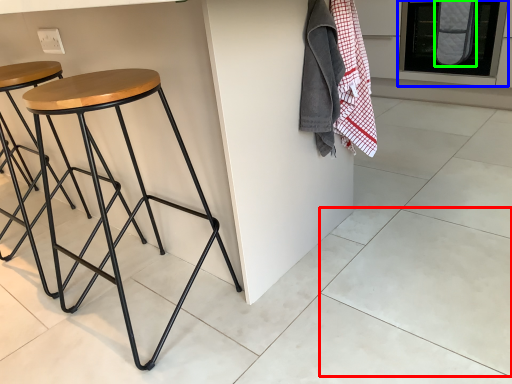
Question: Which object is the closest to the tile (highlighted by a red box)? Choose among these: oven (highlighted by a blue box) or blanket (highlighted by a green box).

Choices:
 (A) oven
 (B) blanket

Answer: (B)